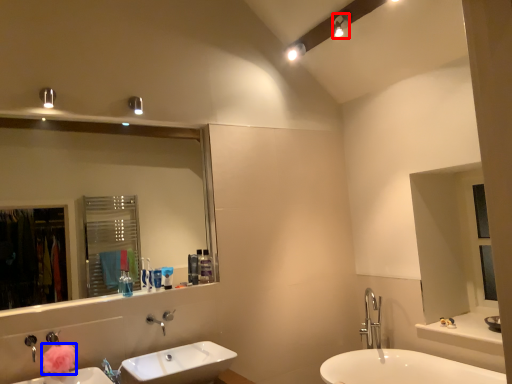
Question: Among these objects, which one is farthest to the camera, light fixture (highlighted by a red box) or flower (highlighted by a blue box)?

Choices:
 (A) light fixture
 (B) flower

Answer: (A)